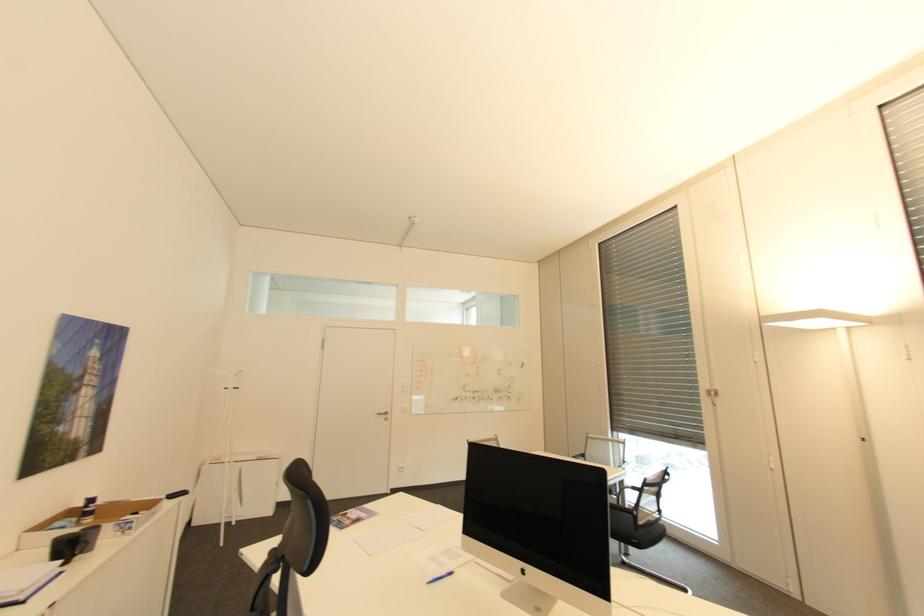
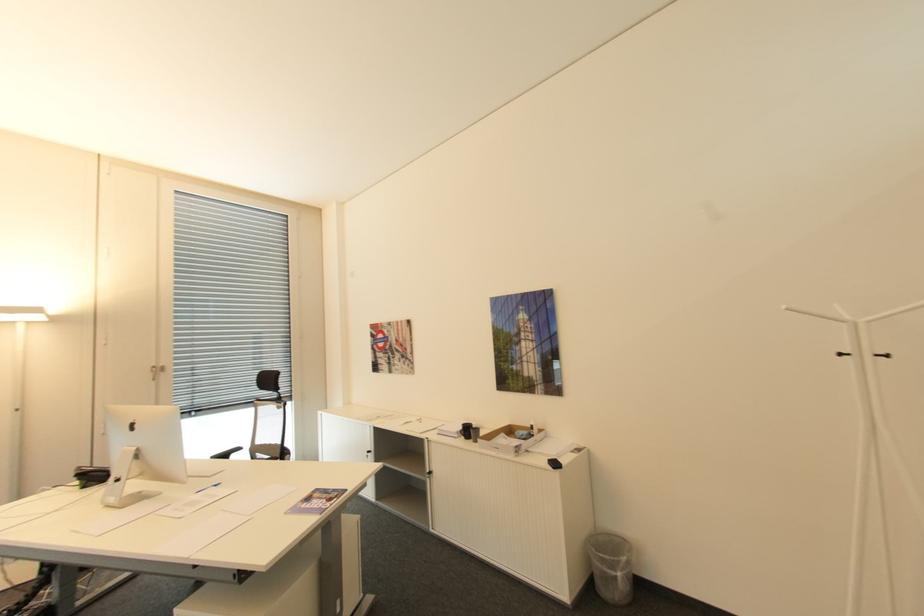
In the second image, find the point that corresponds to point (242, 387) in the first image.

(894, 355)